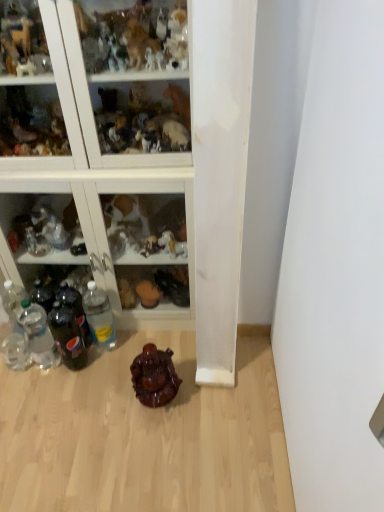
At what (x,y) coordinates should I click in order to perform the action: click on vacant space to the right of clear plastic bottles at left, positioned as the second bottle in left-to-right order. Please return your answer as a coordinate pair (x, y). Image resolution: width=384 pixels, height=512 pixels. Looking at the image, I should click on (92, 373).